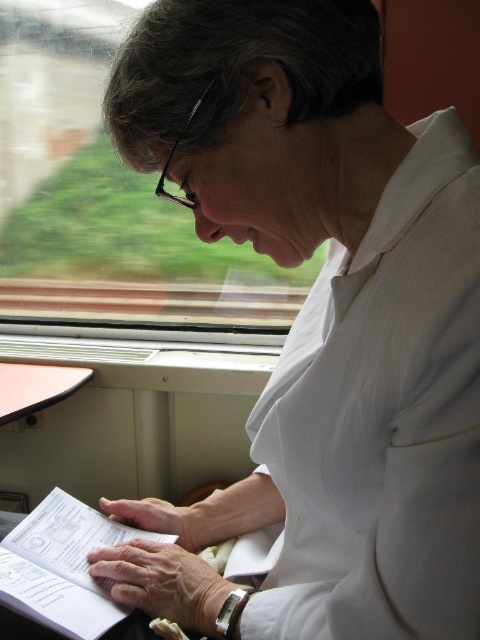
Does point (203, 317) come in front of point (85, 552)?

That is False.

Which is more to the left, transparent glass train window at upper left or white paper book at lower left?

transparent glass train window at upper left

Identify the location of transparent glass train window at upper left. (104, 198).